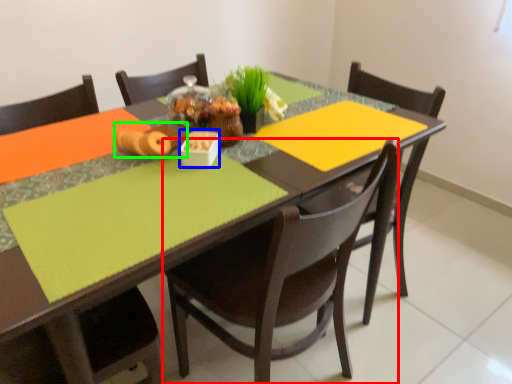
Question: Based on their relative distances, which object is nearer to chair (highlighted by a red box)? Choose from tableware (highlighted by a blue box) and food (highlighted by a green box).

Choices:
 (A) tableware
 (B) food

Answer: (A)